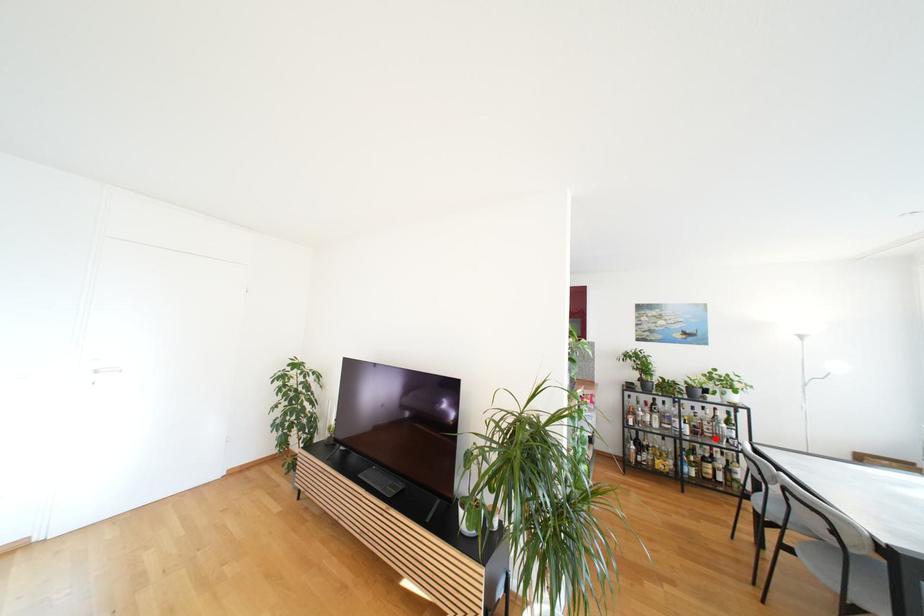
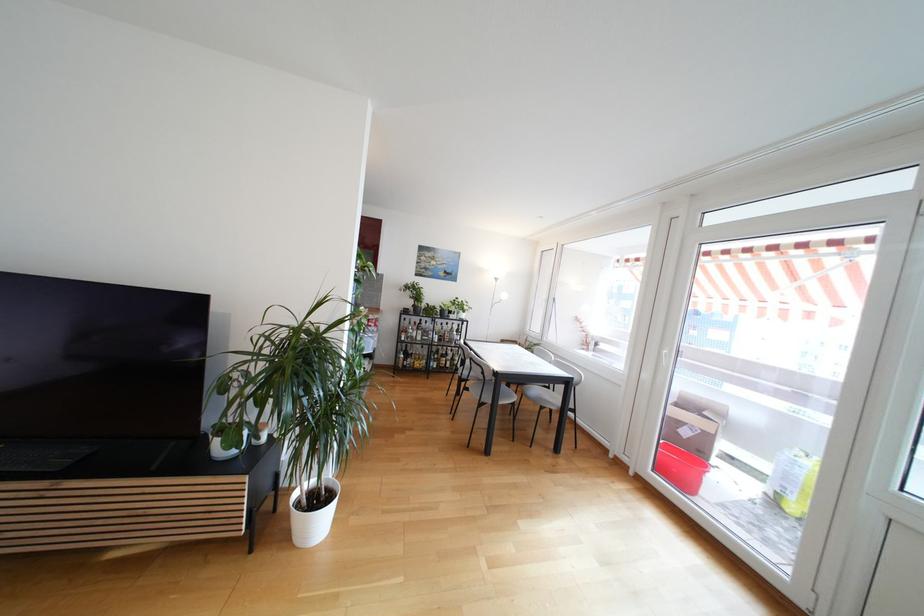
Question: I am providing you with two images of the same scene from different viewpoints. A red point is shown in image1. For the corresponding object point in image2, is it positioned nearer or farther from the camera?

Choices:
 (A) Nearer
 (B) Farther

Answer: (B)